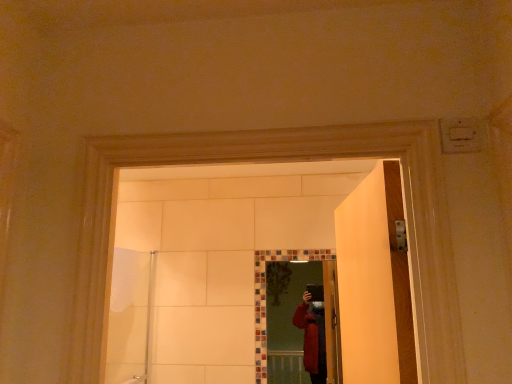
This screenshot has height=384, width=512. Describe the element at coordinates (130, 316) in the screenshot. I see `white fabric shower door at left` at that location.

Find the location of `white fabric shower door at left`. white fabric shower door at left is located at coordinates (130, 316).

What do you see at coordinates (303, 324) in the screenshot? I see `multicolored mosaic mirror at center` at bounding box center [303, 324].

This screenshot has height=384, width=512. In order to click on multicolored mosaic mirror at center in this screenshot , I will do `click(303, 324)`.

Identify the location of white fabric shower door at left. The width and height of the screenshot is (512, 384). (130, 316).

Which is more to the right, white fabric shower door at left or multicolored mosaic mirror at center?

multicolored mosaic mirror at center.

Is the depth of white fabric shower door at left greater than that of multicolored mosaic mirror at center?

No, white fabric shower door at left is in front of multicolored mosaic mirror at center.

Is point (116, 329) positioned before point (300, 362)?

Yes.

From the image's perspective, would you say white fabric shower door at left is positioned over multicolored mosaic mirror at center?

Yes, from the image's perspective, white fabric shower door at left is over multicolored mosaic mirror at center.

From a real-world perspective, which is physically below, white fabric shower door at left or multicolored mosaic mirror at center?

white fabric shower door at left, from a real-world perspective.

Considering the relative sizes of white fabric shower door at left and multicolored mosaic mirror at center in the image provided, is white fabric shower door at left thinner than multicolored mosaic mirror at center?

No.

Considering the sizes of objects white fabric shower door at left and multicolored mosaic mirror at center in the image provided, who is shorter, white fabric shower door at left or multicolored mosaic mirror at center?

multicolored mosaic mirror at center.

Considering the sizes of objects white fabric shower door at left and multicolored mosaic mirror at center in the image provided, who is smaller, white fabric shower door at left or multicolored mosaic mirror at center?

multicolored mosaic mirror at center is smaller.

Is white fabric shower door at left outside of multicolored mosaic mirror at center?

Indeed, white fabric shower door at left is completely outside multicolored mosaic mirror at center.

Is white fabric shower door at left with multicolored mosaic mirror at center?

white fabric shower door at left and multicolored mosaic mirror at center are not in contact.

Could you tell me if white fabric shower door at left is facing multicolored mosaic mirror at center?

Yes.

How much distance is there between white fabric shower door at left and multicolored mosaic mirror at center?

white fabric shower door at left is 35.36 inches away from multicolored mosaic mirror at center.

Where is `shower door in front of the multicolored mosaic mirror at center`? This screenshot has height=384, width=512. shower door in front of the multicolored mosaic mirror at center is located at coordinates (130, 316).

Is multicolored mosaic mirror at center to the left or to the right of white fabric shower door at left in the image?

In the image, multicolored mosaic mirror at center appears on the right side of white fabric shower door at left.

Does multicolored mosaic mirror at center come behind white fabric shower door at left?

That is True.

Between point (306, 351) and point (124, 354), which one is positioned in front?

Point (124, 354)

From the image's perspective, between multicolored mosaic mirror at center and white fabric shower door at left, who is located below?

multicolored mosaic mirror at center appears lower in the image.

From a real-world perspective, between multicolored mosaic mirror at center and white fabric shower door at left, who is vertically higher?

multicolored mosaic mirror at center.

Between multicolored mosaic mirror at center and white fabric shower door at left, which one has smaller width?

With smaller width is multicolored mosaic mirror at center.

From their relative heights in the image, would you say multicolored mosaic mirror at center is taller or shorter than white fabric shower door at left?

multicolored mosaic mirror at center is shorter than white fabric shower door at left.

Looking at the image, does multicolored mosaic mirror at center seem bigger or smaller compared to white fabric shower door at left?

Considering their sizes, multicolored mosaic mirror at center takes up less space than white fabric shower door at left.

Is multicolored mosaic mirror at center not inside white fabric shower door at left?

Yes, multicolored mosaic mirror at center is outside of white fabric shower door at left.

Can you see multicolored mosaic mirror at center touching white fabric shower door at left?

No, multicolored mosaic mirror at center is not next to white fabric shower door at left.

Is multicolored mosaic mirror at center oriented away from white fabric shower door at left?

multicolored mosaic mirror at center is not turned away from white fabric shower door at left.

Image resolution: width=512 pixels, height=384 pixels. In the image, there is a white fabric shower door at left. What are the coordinates of `mirror below it (from the image's perspective)` in the screenshot? It's located at (303, 324).

At what (x,y) coordinates should I click in order to perform the action: click on mirror that is on the right side of white fabric shower door at left. Please return your answer as a coordinate pair (x, y). Looking at the image, I should click on (303, 324).

Locate an element on the screen. mirror behind the white fabric shower door at left is located at coordinates (303, 324).